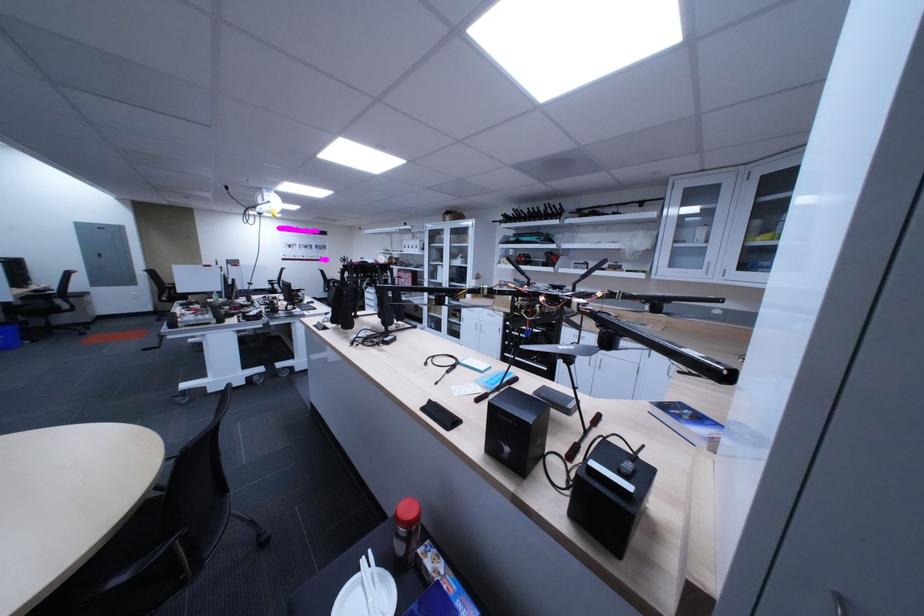
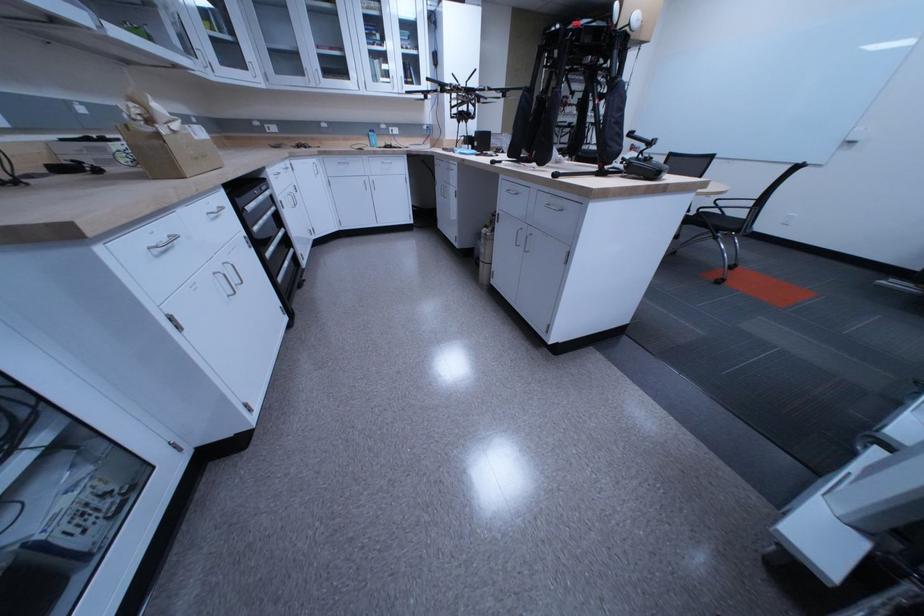
Question: I am providing you with two images of the same scene from different viewpoints. Which of the following objects are not visible in image2?

Choices:
 (A) blue water bottle
 (B) upper cabinet handle
 (C) silver drawer pull
 (D) silver toaster button

Answer: (C)